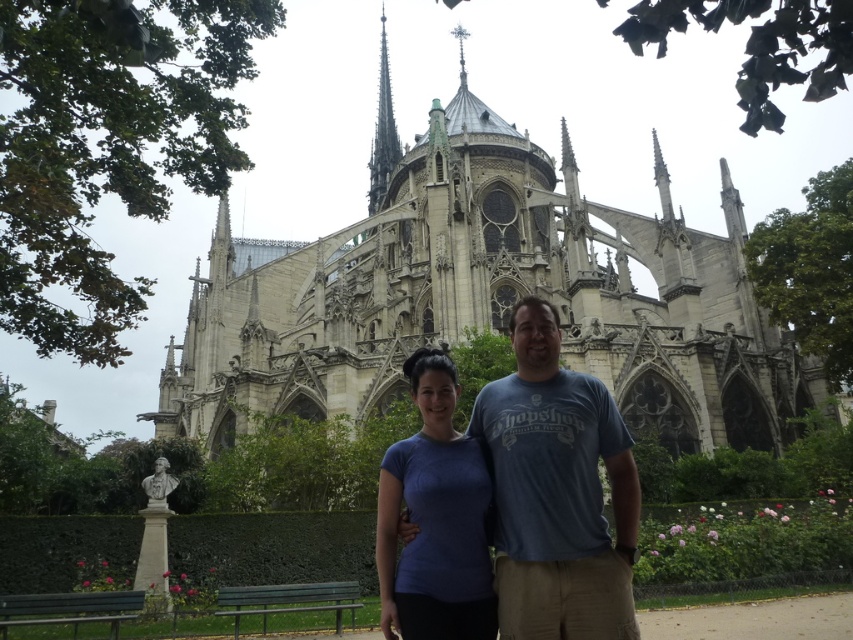
Image resolution: width=853 pixels, height=640 pixels. What do you see at coordinates (556, 492) in the screenshot?
I see `blue cotton shirt at center` at bounding box center [556, 492].

Can you confirm if blue cotton shirt at center is bigger than gray stone spire at upper center?

No.

Who is more distant from viewer, (524, 390) or (386, 132)?

The point (386, 132) is behind.

At what (x,y) coordinates should I click in order to perform the action: click on blue cotton shirt at center. Please return your answer as a coordinate pair (x, y). The image size is (853, 640). Looking at the image, I should click on (556, 492).

Who is positioned more to the right, blue cotton shirt at center or blue fabric shirt at center?

Positioned to the right is blue cotton shirt at center.

This screenshot has width=853, height=640. What do you see at coordinates (556, 492) in the screenshot? I see `blue cotton shirt at center` at bounding box center [556, 492].

You are a GUI agent. You are given a task and a screenshot of the screen. Output one action in this format:
    pyautogui.click(x=<x>, y=<y>)
    Task: Click on the blue cotton shirt at center
    
    Given the screenshot: What is the action you would take?
    pyautogui.click(x=556, y=492)

Which of these two, stone gothic cathedral at center or blue cotton shirt at center, stands shorter?

Standing shorter between the two is blue cotton shirt at center.

Which is in front, point (585, 339) or point (509, 461)?

Point (509, 461)

In order to click on stone gothic cathedral at center in this screenshot , I will do `click(486, 298)`.